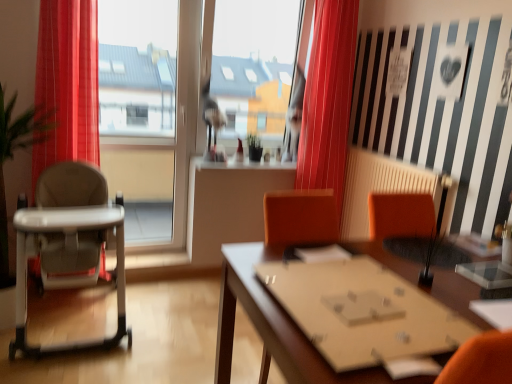
Image resolution: width=512 pixels, height=384 pixels. What do you see at coordinates (381, 187) in the screenshot?
I see `beige radiator at center` at bounding box center [381, 187].

The height and width of the screenshot is (384, 512). In order to click on beige radiator at center in this screenshot , I will do `click(381, 187)`.

This screenshot has height=384, width=512. What do you see at coordinates (276, 327) in the screenshot?
I see `wooden table at center` at bounding box center [276, 327].

What is the approximate height of transparent glass window at center?

The height of transparent glass window at center is 1.82 meters.

Locate an element on the screen. This screenshot has height=384, width=512. red velvet curtain at center is located at coordinates (328, 97).

Is red velvet curtain at center facing away from wooden table at center?

That's not correct — red velvet curtain at center is not looking away from wooden table at center.

Is red velvet curtain at center further to the viewer compared to wooden table at center?

Yes, it is behind wooden table at center.

Between red velvet curtain at center and wooden table at center, which one has larger width?

Wider between the two is wooden table at center.

Does red velvet curtain at center touch wooden table at center?

red velvet curtain at center and wooden table at center are not in contact.

Would you say white plastic highchair at left contains red velvet curtain at center?

No, red velvet curtain at center is not inside white plastic highchair at left.

Is white plastic highchair at left looking in the opposite direction of red velvet curtain at center?

No, red velvet curtain at center is not at the back of white plastic highchair at left.

Can you tell me how much white plastic highchair at left and red velvet curtain at center differ in facing direction?

1.04 degrees.

Is the depth of white plastic highchair at left greater than that of red velvet curtain at center?

No, white plastic highchair at left is closer to the viewer.

Is red velvet curtain at center turned away from beige radiator at center?

No.

Would you say beige radiator at center is part of red velvet curtain at center's contents?

Definitely not — beige radiator at center is not inside red velvet curtain at center.

In the scene shown: Which object is closer to the camera taking this photo, red velvet curtain at center or beige radiator at center?

Positioned in front is beige radiator at center.

Is red velvet curtain at center beside beige radiator at center?

red velvet curtain at center is not next to beige radiator at center, and they're not touching.

Considering the sizes of beige radiator at center and white plastic highchair at left in the image, is beige radiator at center bigger or smaller than white plastic highchair at left?

Considering their sizes, beige radiator at center takes up less space than white plastic highchair at left.

Who is taller, beige radiator at center or white plastic highchair at left?

white plastic highchair at left is taller.

The image size is (512, 384). I want to click on radiator behind the white plastic highchair at left, so click(x=381, y=187).

Who is taller, transparent glass window at center or wooden table at center?

transparent glass window at center is taller.

From a real-world perspective, which is physically below, transparent glass window at center or wooden table at center?

In real-world perspective, wooden table at center is lower.

Between transparent glass window at center and wooden table at center, which one is positioned in front?

Positioned in front is wooden table at center.

In the scene shown: What's the angular difference between transparent glass window at center and wooden table at center's facing directions?

90.6 degrees.

Would you say transparent glass window at center is a long distance from beige radiator at center?

Yes, transparent glass window at center and beige radiator at center are quite far apart.

In the scene shown: Can you tell me how much transparent glass window at center and beige radiator at center differ in facing direction?

89.8 degrees.

Is the depth of transparent glass window at center less than that of beige radiator at center?

No, transparent glass window at center is behind beige radiator at center.

Considering the positions of objects red velvet curtain at center and white plastic highchair at left in the image provided, who is more to the left, red velvet curtain at center or white plastic highchair at left?

white plastic highchair at left is more to the left.

Is point (337, 153) more distant than point (119, 298)?

Yes.

Could you tell me if red velvet curtain at center is facing white plastic highchair at left?

No, red velvet curtain at center does not turn towards white plastic highchair at left.

Where is `chair located on the left of red velvet curtain at center`? This screenshot has width=512, height=384. chair located on the left of red velvet curtain at center is located at coordinates (68, 244).

You are a GUI agent. You are given a task and a screenshot of the screen. Output one action in this format:
    pyautogui.click(x=<x>, y=<y>)
    Task: Click on the curtain lying above the wooden table at center (from the image's perspective)
    This screenshot has width=512, height=384.
    Given the screenshot: What is the action you would take?
    pyautogui.click(x=328, y=97)

Image resolution: width=512 pixels, height=384 pixels. What are the coordinates of `curtain behind the white plastic highchair at left` in the screenshot? It's located at (328, 97).

Estimate the real-world distances between objects in this image. Which object is closer to beige radiator at center, transparent glass window at center or red velvet curtain at center?

red velvet curtain at center is closer to beige radiator at center.

From the image, which object appears to be farther from white plastic highchair at left, transparent glass window at center or wooden table at center?

Among the two, wooden table at center is located further to white plastic highchair at left.

Which object lies nearer to the anchor point white plastic highchair at left, wooden table at center or transparent glass window at center?

transparent glass window at center.

In the scene shown: Which object lies nearer to the anchor point red velvet curtain at center, beige radiator at center or white plastic highchair at left?

Among the two, beige radiator at center is located nearer to red velvet curtain at center.

When comparing their distances from red velvet curtain at center, does wooden table at center or beige radiator at center seem further?

Based on the image, wooden table at center appears to be further to red velvet curtain at center.

From the image, which object appears to be nearer to wooden table at center, red velvet curtain at center or white plastic highchair at left?

white plastic highchair at left is closer to wooden table at center.

Based on the photo, when comparing their distances from transparent glass window at center, does wooden table at center or red velvet curtain at center seem further?

The object further to transparent glass window at center is wooden table at center.

Based on their spatial positions, is red velvet curtain at center or beige radiator at center further from wooden table at center?

red velvet curtain at center.

This screenshot has height=384, width=512. In order to click on window screen between white plastic highchair at left and red velvet curtain at center in the horizontal direction in this screenshot , I will do `click(137, 67)`.

At what (x,y) coordinates should I click in order to perform the action: click on curtain between white plastic highchair at left and wooden table at center from left to right. Please return your answer as a coordinate pair (x, y). The width and height of the screenshot is (512, 384). Looking at the image, I should click on (328, 97).

Identify the location of window screen between white plastic highchair at left and beige radiator at center in the horizontal direction. (137, 67).

In order to click on radiator between wooden table at center and red velvet curtain at center from front to back in this screenshot , I will do `click(381, 187)`.